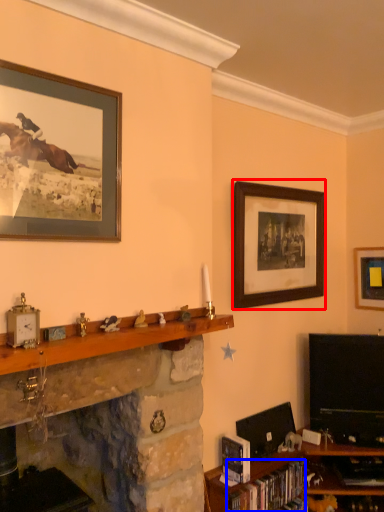
Question: Which point is closer to the camera, picture frame (highlighted by a red box) or book (highlighted by a blue box)?

Choices:
 (A) picture frame
 (B) book

Answer: (B)